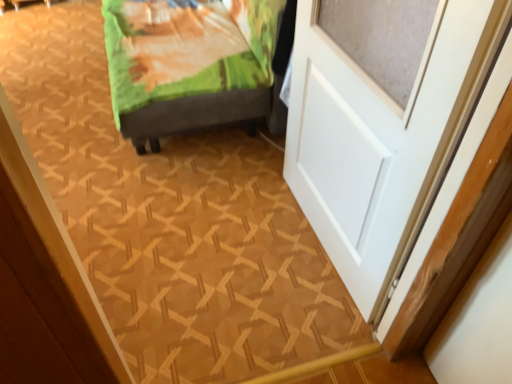
I want to click on vacant space to the left of white matte door at right, so click(220, 243).